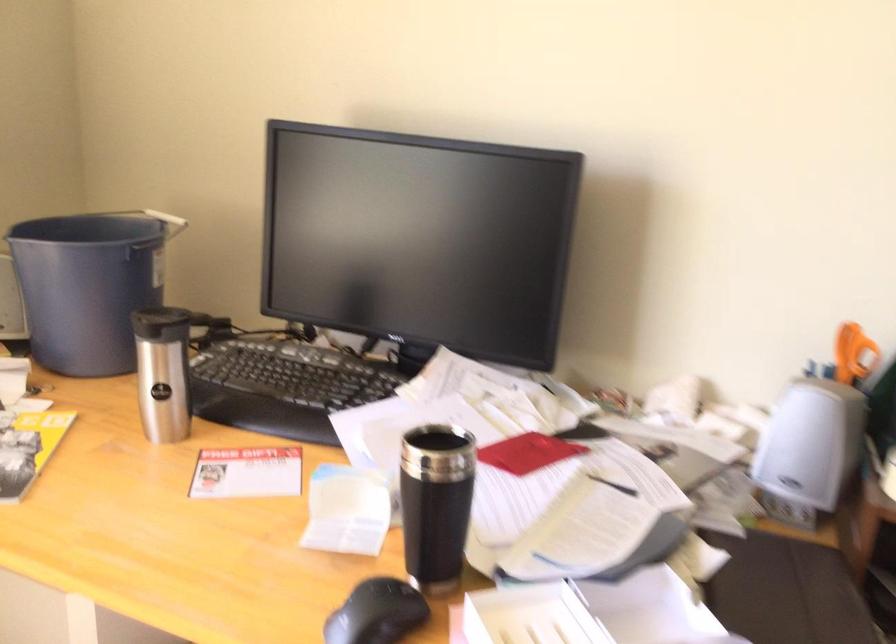
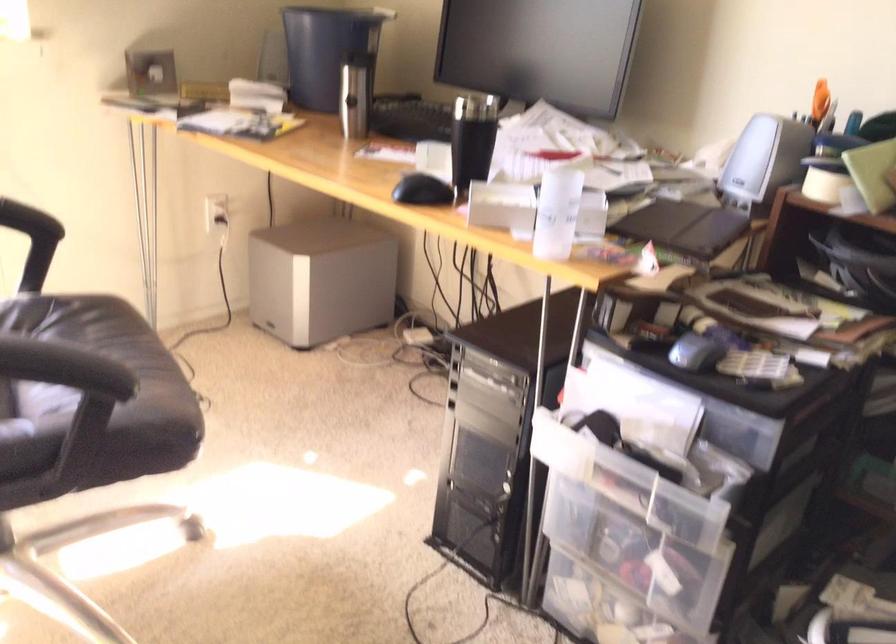
Locate, in the second image, the point that corresponds to (x=446, y=509) in the first image.

(471, 140)